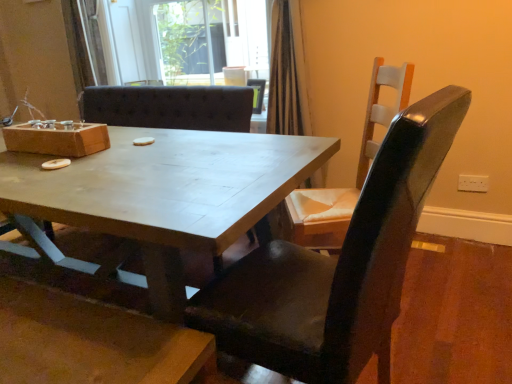
Question: Does wooden chair at right, acting as the first chair starting from the back, come behind matte wooden table at center?

Choices:
 (A) yes
 (B) no

Answer: (A)

Question: Does wooden chair at right, acting as the first chair starting from the back, have a lesser height compared to matte wooden table at center?

Choices:
 (A) yes
 (B) no

Answer: (B)

Question: Is matte wooden table at center completely or partially inside wooden chair at right, acting as the second chair starting from the front?

Choices:
 (A) yes
 (B) no

Answer: (B)

Question: Can we say wooden chair at right, acting as the first chair starting from the back, lies outside matte wooden table at center?

Choices:
 (A) no
 (B) yes

Answer: (B)

Question: Can you confirm if wooden chair at right, acting as the first chair starting from the back, is wider than matte wooden table at center?

Choices:
 (A) no
 (B) yes

Answer: (A)

Question: Is point (145, 24) closer or farther from the camera than point (194, 165)?

Choices:
 (A) closer
 (B) farther

Answer: (B)

Question: Considering the positions of transparent glass door at upper center and matte wooden table at center in the image, is transparent glass door at upper center taller or shorter than matte wooden table at center?

Choices:
 (A) tall
 (B) short

Answer: (B)

Question: Looking at the image, does transparent glass door at upper center seem bigger or smaller compared to matte wooden table at center?

Choices:
 (A) big
 (B) small

Answer: (B)

Question: From a real-world perspective, is transparent glass door at upper center physically located above or below matte wooden table at center?

Choices:
 (A) below
 (B) above

Answer: (B)

Question: Looking at their shapes, would you say wooden chair at right, acting as the second chair starting from the front, is wider or thinner than matte black chair at center, which appears as the first chair when viewed from the front?

Choices:
 (A) thin
 (B) wide

Answer: (A)

Question: From the image's perspective, is wooden chair at right, acting as the first chair starting from the back, positioned above or below matte black chair at center, which appears as the first chair when viewed from the front?

Choices:
 (A) above
 (B) below

Answer: (A)

Question: Is point (326, 231) closer or farther from the camera than point (409, 182)?

Choices:
 (A) farther
 (B) closer

Answer: (A)

Question: Do you think wooden chair at right, acting as the second chair starting from the front, is within matte black chair at center, the second chair positioned from the back, or outside of it?

Choices:
 (A) inside
 (B) outside

Answer: (B)

Question: From a real-world perspective, is wooden chair at right, acting as the second chair starting from the front, positioned above or below matte wooden table at center?

Choices:
 (A) below
 (B) above

Answer: (B)

Question: Considering the positions of point (332, 220) and point (228, 193), is point (332, 220) closer or farther from the camera than point (228, 193)?

Choices:
 (A) closer
 (B) farther

Answer: (B)